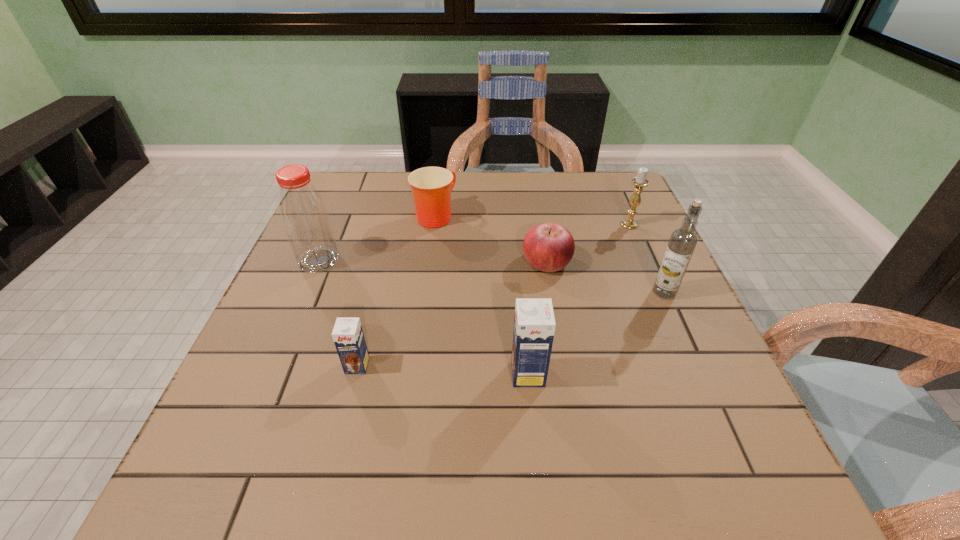
Find the location of `the left chocolate milk`. the left chocolate milk is located at coordinates (348, 337).

Image resolution: width=960 pixels, height=540 pixels. In order to click on the shorter chocolate milk in this screenshot , I will do `click(348, 337)`.

I want to click on the right chocolate milk, so click(x=534, y=324).

I want to click on cup, so click(431, 187).

Locate an element on the screen. The image size is (960, 540). candle holder is located at coordinates (640, 181).

Find the location of a particular element. bottle is located at coordinates (303, 211).

Identify the location of apple. The height and width of the screenshot is (540, 960). (549, 247).

Find the location of a particular element. vodka is located at coordinates (682, 242).

Locate an element on the screen. The width and height of the screenshot is (960, 540). vacant area situated 0.100m on the front label of the shorter chocolate milk is located at coordinates (343, 423).

Identify the location of free space located on the front label of the right chocolate milk. This screenshot has width=960, height=540. (378, 374).